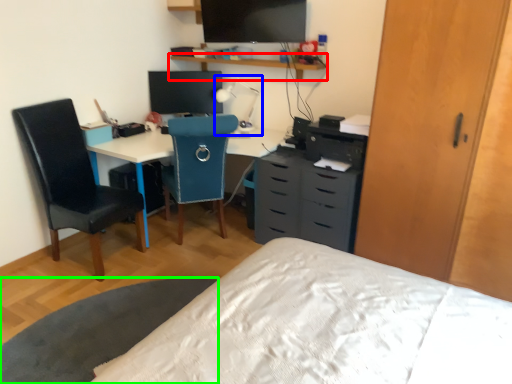
Question: Estimate the real-world distances between objects in this image. Which object is closer to shelf (highlighted by a red box), table lamp (highlighted by a blue box) or table (highlighted by a green box)?

Choices:
 (A) table lamp
 (B) table

Answer: (A)